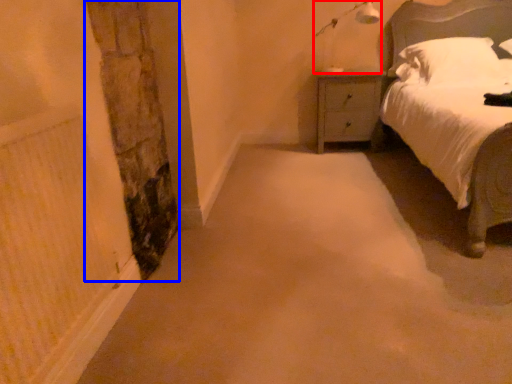
Question: Which object appears closest to the camera in this image, light fixture (highlighted by a red box) or pillar (highlighted by a blue box)?

Choices:
 (A) light fixture
 (B) pillar

Answer: (B)